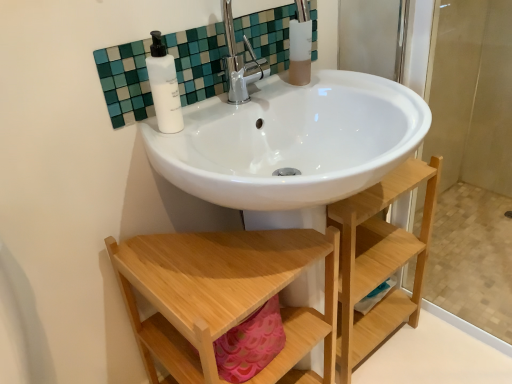
This screenshot has width=512, height=384. Find the location of `vacant space in front of white matte bottle at upper center`. vacant space in front of white matte bottle at upper center is located at coordinates (189, 156).